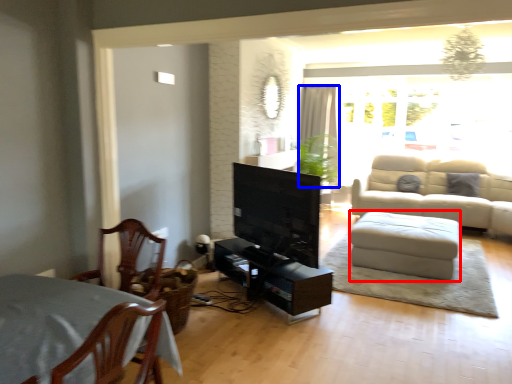
Question: Which object appears closest to the camera in this image, footrest (highlighted by a red box) or curtain (highlighted by a blue box)?

Choices:
 (A) footrest
 (B) curtain

Answer: (A)